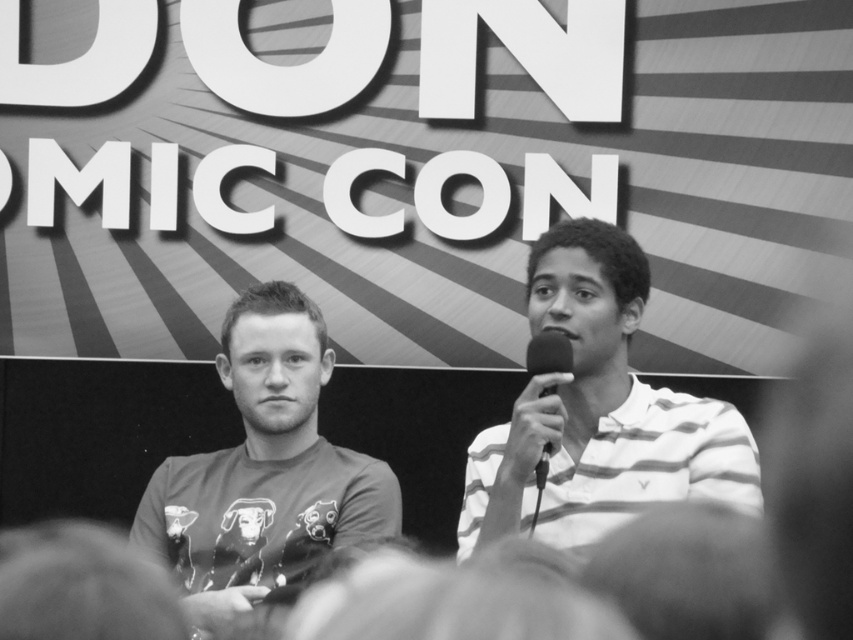
Question: Does striped cotton shirt at right appear over matte gray t-shirt at center?

Choices:
 (A) yes
 (B) no

Answer: (A)

Question: Can you confirm if matte gray t-shirt at center is positioned to the right of metallic silver microphone at center?

Choices:
 (A) no
 (B) yes

Answer: (A)

Question: Which object is positioned closest to the matte gray t-shirt at center?

Choices:
 (A) metallic silver microphone at center
 (B) striped cotton shirt at right

Answer: (B)

Question: Is striped cotton shirt at right positioned before metallic silver microphone at center?

Choices:
 (A) yes
 (B) no

Answer: (A)

Question: Which object is positioned farthest from the metallic silver microphone at center?

Choices:
 (A) matte gray t-shirt at center
 (B) striped cotton shirt at right

Answer: (A)

Question: Considering the real-world distances, which object is closest to the striped cotton shirt at right?

Choices:
 (A) matte gray t-shirt at center
 (B) metallic silver microphone at center

Answer: (B)